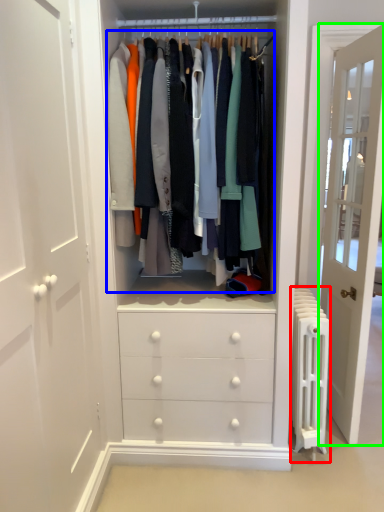
Question: Considering the real-world distances, which object is farthest from radiator (highlighted by a red box)? closet (highlighted by a blue box) or door (highlighted by a green box)?

Choices:
 (A) closet
 (B) door

Answer: (A)